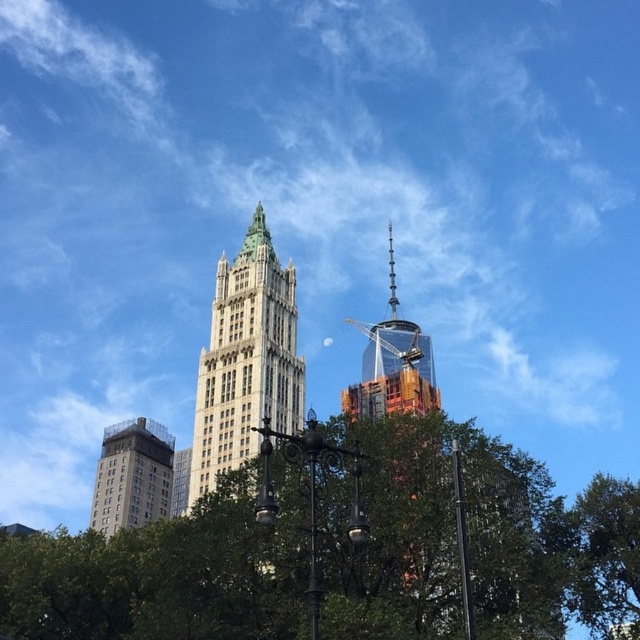
Question: Can you confirm if green leafy tree at center is bigger than gray concrete bell tower at lower left?

Choices:
 (A) no
 (B) yes

Answer: (B)

Question: Which is nearer to the gray concrete bell tower at lower left?

Choices:
 (A) orange glass tower at upper center
 (B) green leafy tree at center
 (C) white stone tower at center

Answer: (C)

Question: Which point is farther to the camera?

Choices:
 (A) coord(387,360)
 (B) coord(106,490)
 (C) coord(1,612)

Answer: (A)

Question: Observing the image, what is the correct spatial positioning of gray concrete bell tower at lower left in reference to orange glass tower at upper center?

Choices:
 (A) below
 (B) above

Answer: (A)

Question: Does white stone tower at center appear over orange glass tower at upper center?

Choices:
 (A) no
 (B) yes

Answer: (B)

Question: Which object appears closest to the camera in this image?

Choices:
 (A) gray concrete bell tower at lower left
 (B) orange glass tower at upper center
 (C) green leafy tree at center

Answer: (C)